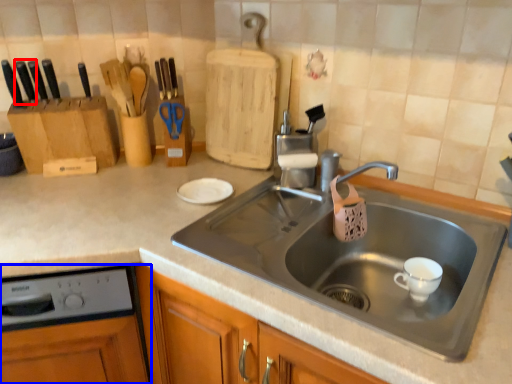
Question: Which object appears farthest to the camera in this image, knife (highlighted by a red box) or dish washer (highlighted by a blue box)?

Choices:
 (A) knife
 (B) dish washer

Answer: (A)